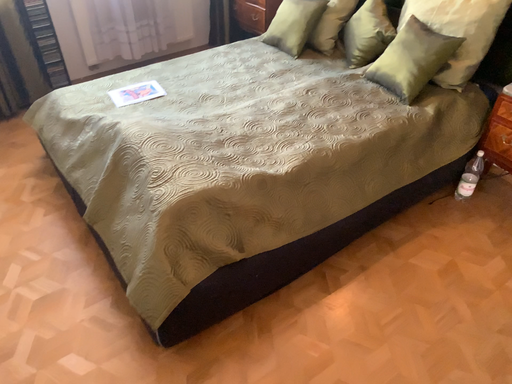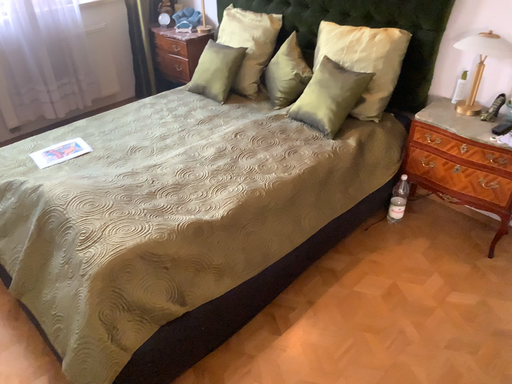
Question: Which way did the camera rotate in the video?

Choices:
 (A) rotated right
 (B) rotated left

Answer: (A)